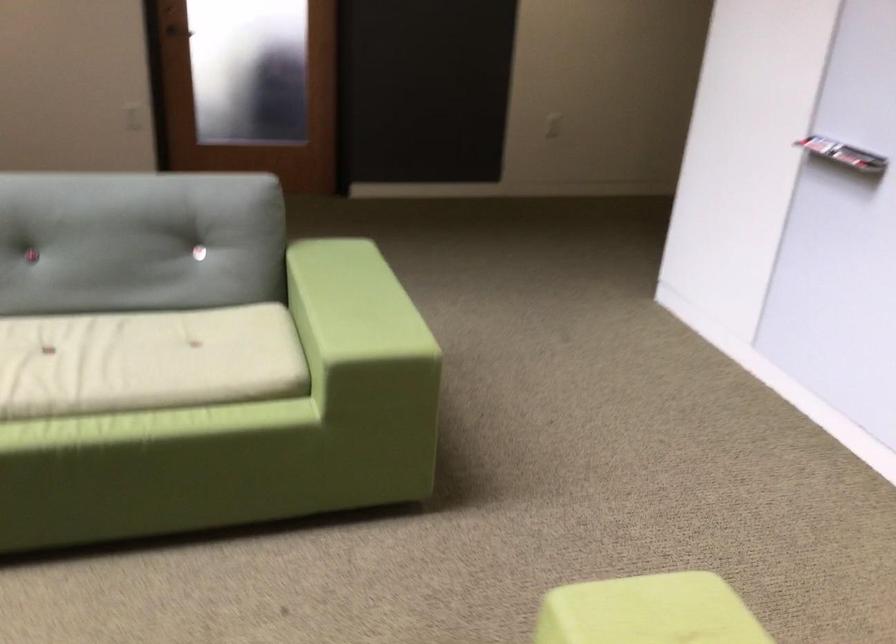
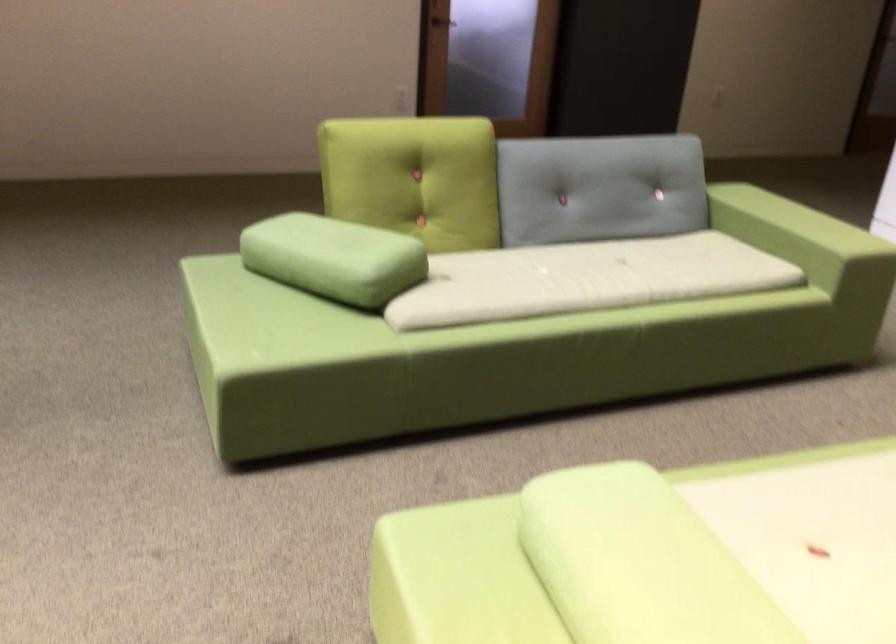
Where in the second image is the point corresponding to the point at 312,334 from the first image?

(794, 241)